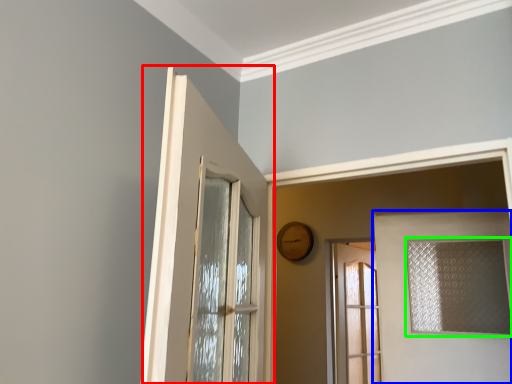
Question: Which is farther away from door (highlighted by a red box)? door (highlighted by a blue box) or window (highlighted by a green box)?

Choices:
 (A) door
 (B) window

Answer: (B)